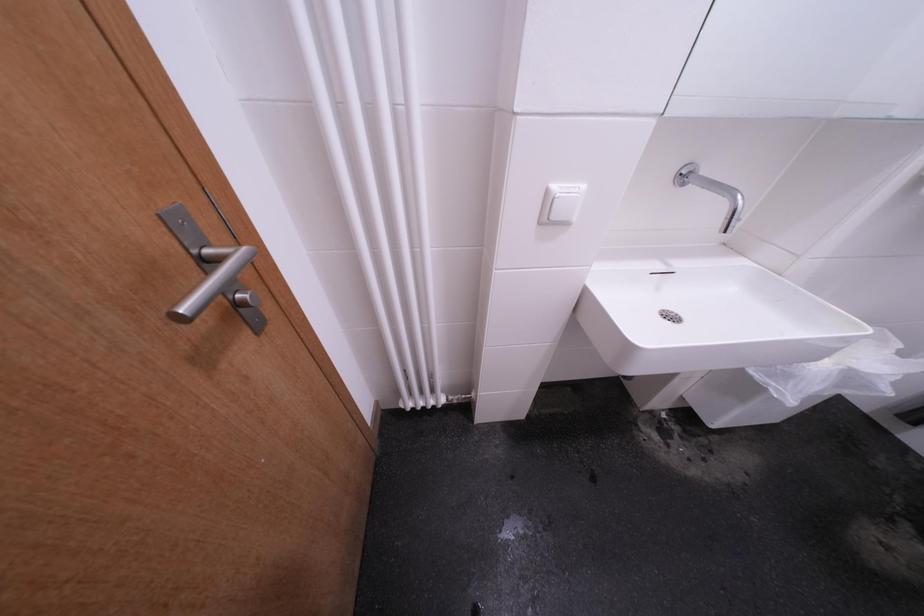
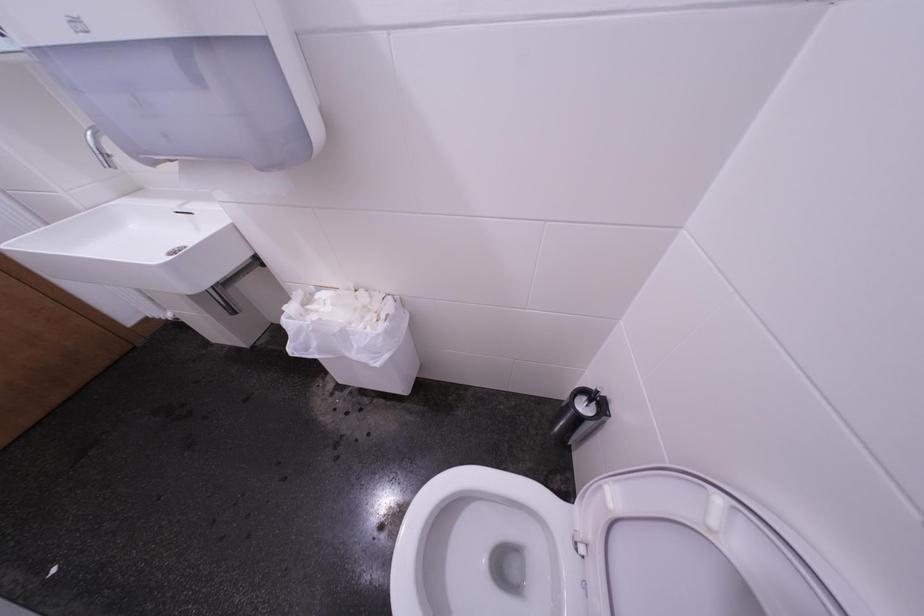
Question: In a continuous first-person perspective shot, in which direction is the camera moving?

Choices:
 (A) Left
 (B) Right
 (C) Forward
 (D) Backward

Answer: (B)